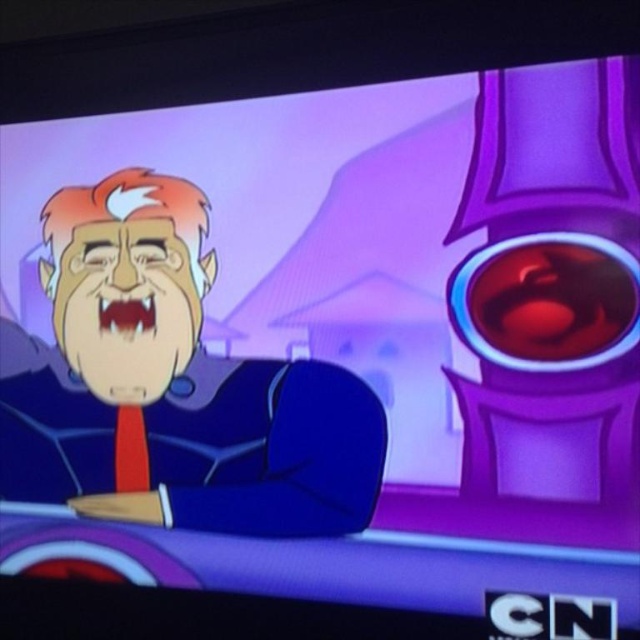
Does matte black suit at left lie behind red matte tie at lower left?

No, it is not.

Which is in front, point (160, 285) or point (145, 465)?

Positioned in front is point (160, 285).

Image resolution: width=640 pixels, height=640 pixels. What do you see at coordinates (172, 385) in the screenshot?
I see `matte black suit at left` at bounding box center [172, 385].

At what (x,y) coordinates should I click in order to perform the action: click on matte black suit at left. Please return your answer as a coordinate pair (x, y). Looking at the image, I should click on (172, 385).